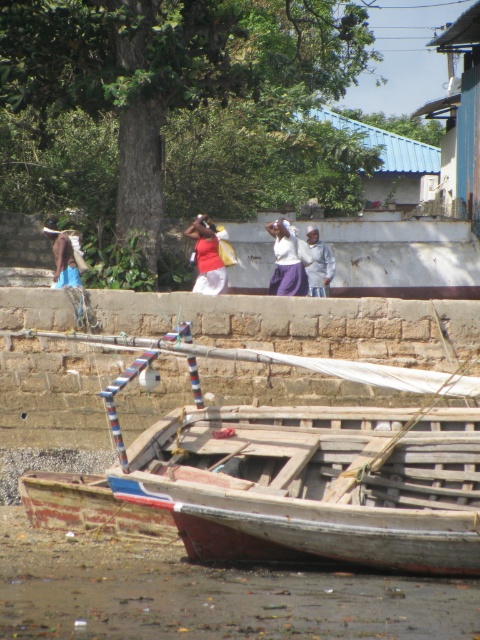
Question: Among these points, which one is farthest from the camera?

Choices:
 (A) (314, 236)
 (B) (212, 282)

Answer: (A)

Question: Can you confirm if white matte shirt at center is positioned to the left of gray fabric at center?

Choices:
 (A) yes
 (B) no

Answer: (A)

Question: Is white matte shirt at center above brown leather jacket at left?

Choices:
 (A) yes
 (B) no

Answer: (B)

Question: Where is rusty wooden boat at lower center located in relation to brown leather jacket at left in the image?

Choices:
 (A) left
 (B) right

Answer: (B)

Question: Which point is closer to the camera?

Choices:
 (A) (145, 467)
 (B) (217, 256)
 (C) (312, 269)

Answer: (A)

Question: Among these points, which one is farthest from the camera?

Choices:
 (A) (299, 266)
 (B) (63, 273)

Answer: (A)